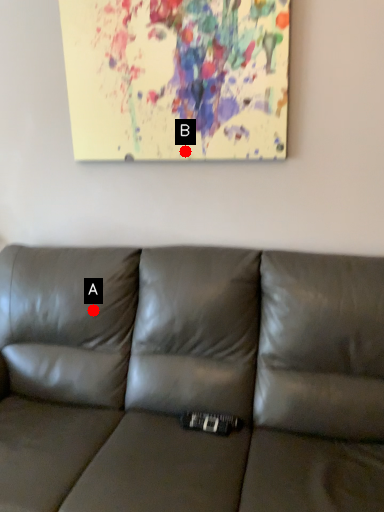
Question: Two points are circled on the image, labeled by A and B beside each circle. Which point is farther to the camera?

Choices:
 (A) A is further
 (B) B is further

Answer: (B)